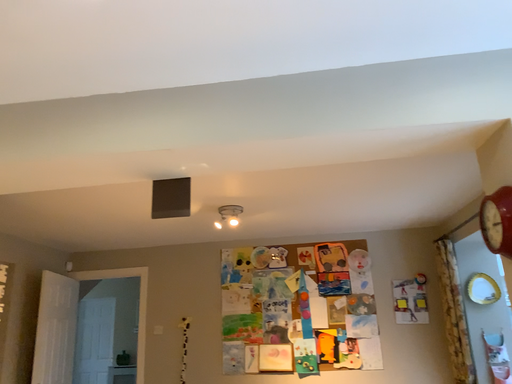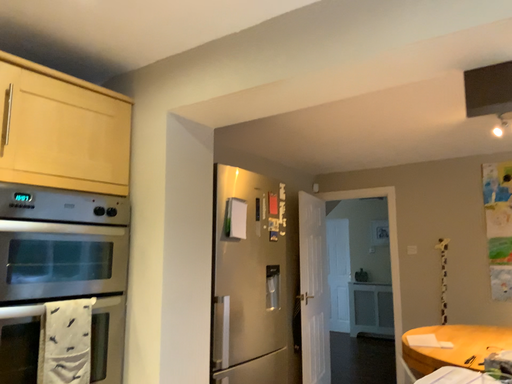
Question: Which way did the camera rotate in the video?

Choices:
 (A) rotated left
 (B) rotated right

Answer: (A)